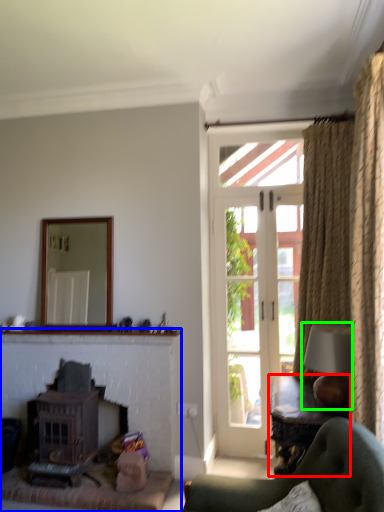
Question: Which object is positioned closest to table (highlighted by a red box)? Select from fireplace (highlighted by a blue box) and lamp (highlighted by a green box).

Choices:
 (A) fireplace
 (B) lamp

Answer: (B)